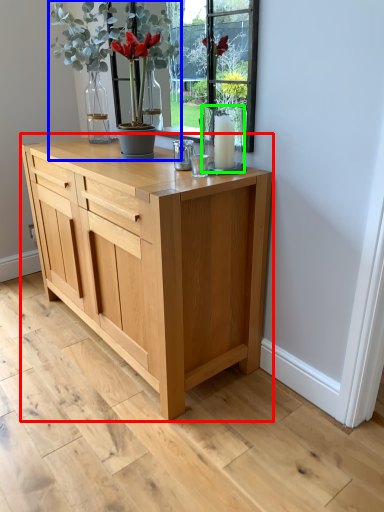
Question: Which is nearer to the chest of drawers (highlighted by a red box)? houseplant (highlighted by a blue box) or glass vase (highlighted by a green box).

Choices:
 (A) houseplant
 (B) glass vase

Answer: (B)